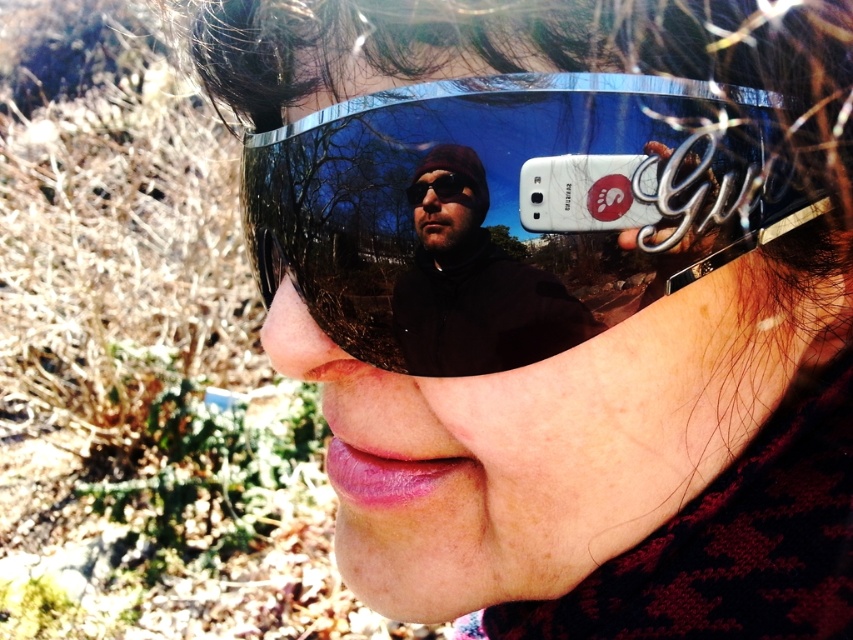
Question: Observing the image, what is the correct spatial positioning of shiny metallic goggles at center in reference to matte black jacket at center?

Choices:
 (A) below
 (B) above

Answer: (B)

Question: Which point appears farthest from the camera in this image?

Choices:
 (A) (421, 307)
 (B) (659, 134)

Answer: (A)

Question: Observing the image, what is the correct spatial positioning of shiny metallic goggles at center in reference to matte black jacket at center?

Choices:
 (A) below
 (B) above

Answer: (B)

Question: Is shiny metallic goggles at center positioned in front of matte black jacket at center?

Choices:
 (A) yes
 (B) no

Answer: (A)

Question: Which point is closer to the camera?

Choices:
 (A) shiny metallic goggles at center
 (B) matte black jacket at center

Answer: (A)